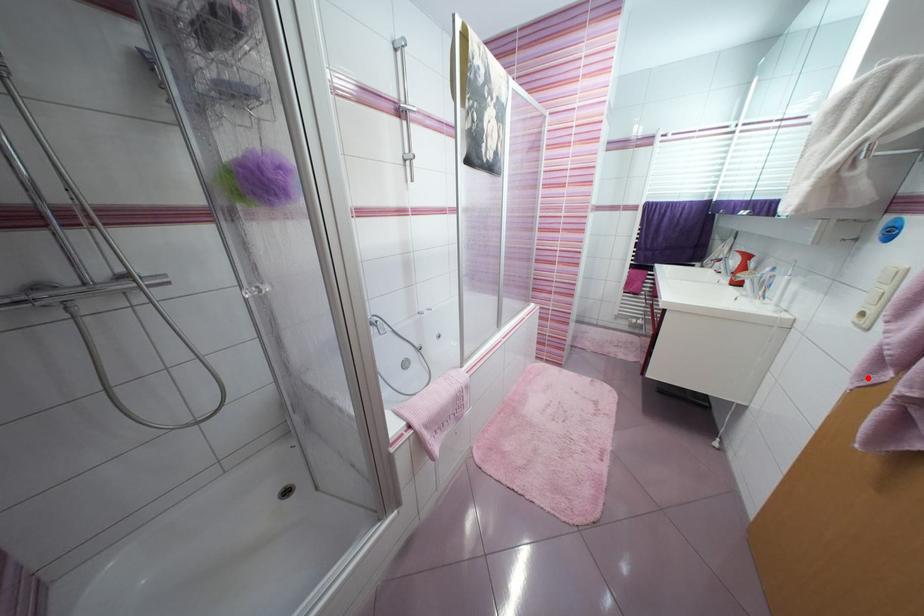
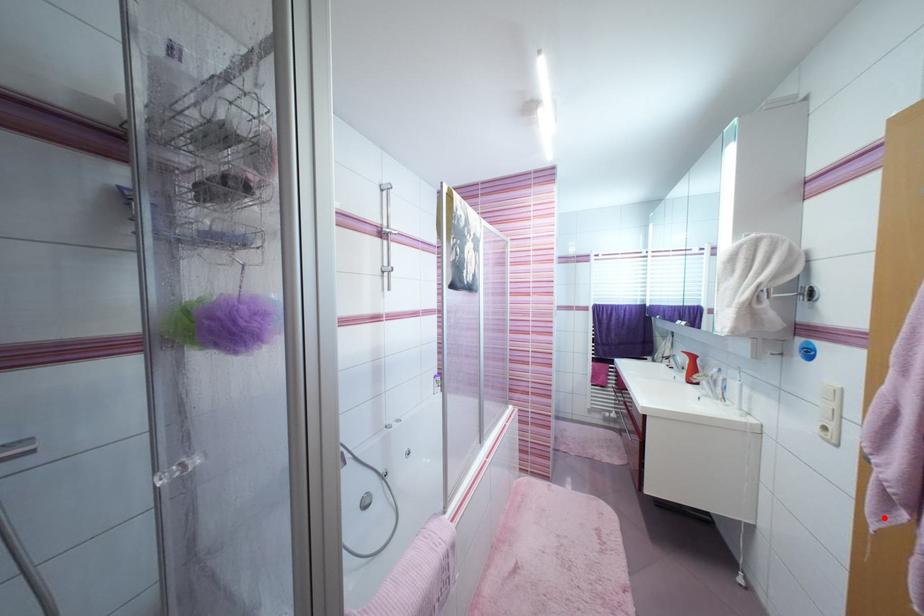
I am providing you with two images of the same scene from different viewpoints. A red point is marked on the first image and another point is marked on the second image. Do the highlighted points in image1 and image2 indicate the same real-world spot?

Yes